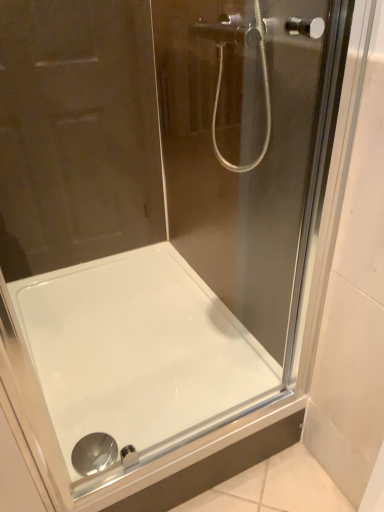
Find the location of a particular element. The image size is (384, 512). white glossy bath at center is located at coordinates (138, 351).

The image size is (384, 512). What do you see at coordinates (138, 351) in the screenshot?
I see `white glossy bath at center` at bounding box center [138, 351].

Where is `white glossy bath at center`? white glossy bath at center is located at coordinates (138, 351).